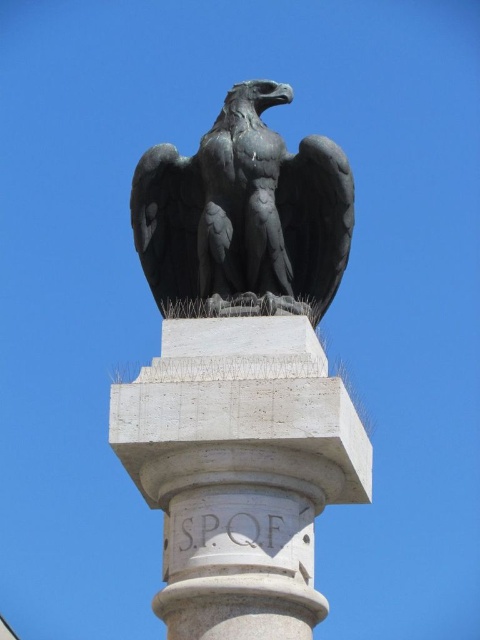
Question: Does white stone pillar at center have a larger size compared to polished bronze eagle at top center?

Choices:
 (A) no
 (B) yes

Answer: (B)

Question: Observing the image, what is the correct spatial positioning of white stone pillar at center in reference to polished bronze eagle at top center?

Choices:
 (A) below
 (B) above

Answer: (A)

Question: Does white stone pillar at center appear under polished bronze eagle at top center?

Choices:
 (A) yes
 (B) no

Answer: (A)

Question: Which object appears closest to the camera in this image?

Choices:
 (A) polished bronze eagle at top center
 (B) white stone pillar at center

Answer: (B)